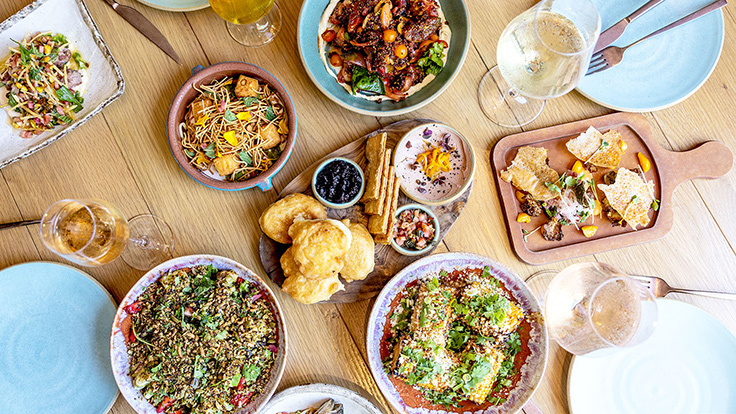
Image resolution: width=736 pixels, height=414 pixels. What are the coordinates of `glass` in the screenshot? It's located at (102, 240), (534, 90), (603, 319), (260, 21).